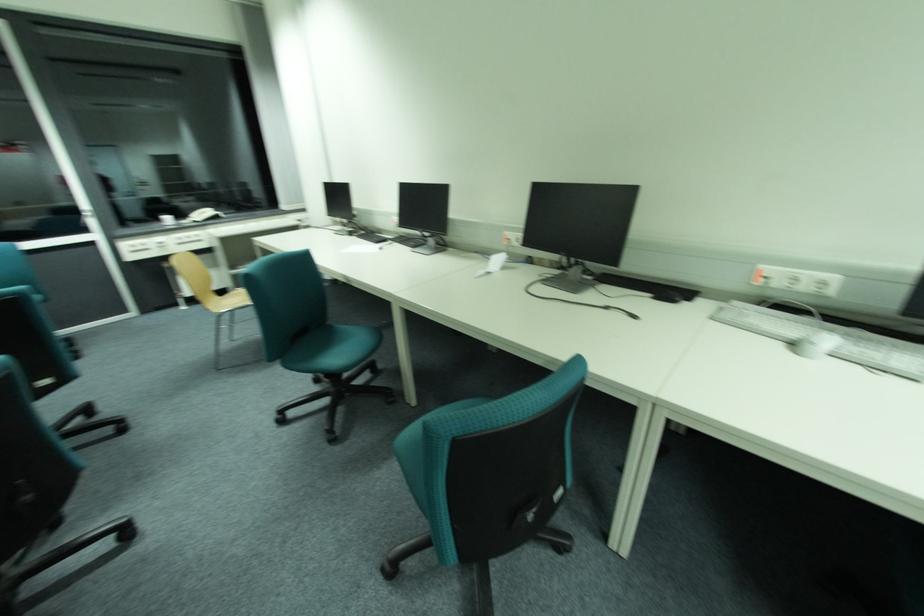
Describe the element at coordinates (492, 264) in the screenshot. I see `the white telephone handset` at that location.